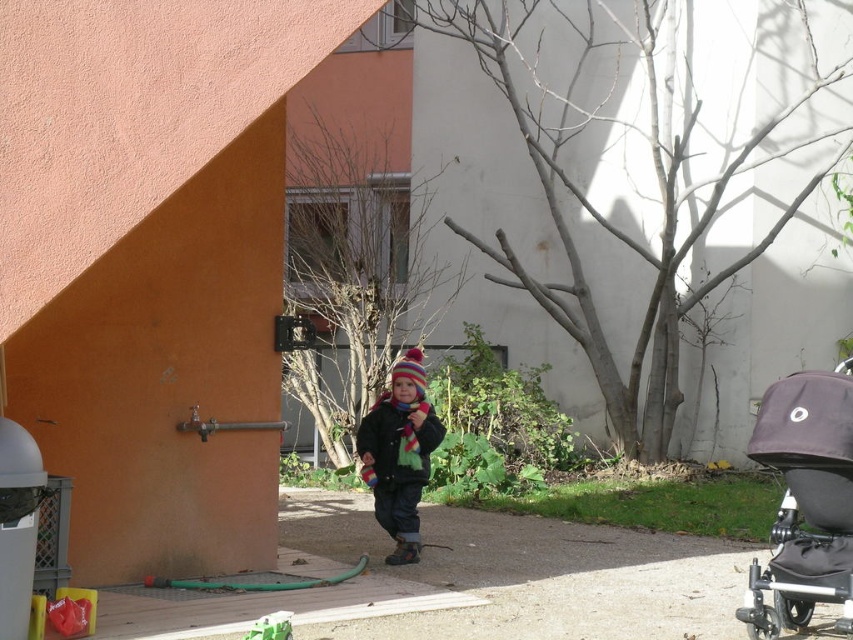
Between dark gray fabric stroller at lower right and striped woolen hat at center, which one is positioned lower?

dark gray fabric stroller at lower right is below.

Does dark gray fabric stroller at lower right have a lesser width compared to striped woolen hat at center?

In fact, dark gray fabric stroller at lower right might be wider than striped woolen hat at center.

Locate an element on the screen. The height and width of the screenshot is (640, 853). dark gray fabric stroller at lower right is located at coordinates (805, 500).